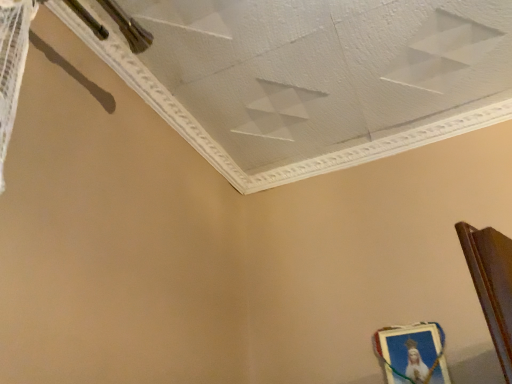
Question: Is point (326, 147) closer or farther from the camera than point (380, 354)?

Choices:
 (A) farther
 (B) closer

Answer: (A)

Question: In terms of size, does white textured ceiling at upper center appear bigger or smaller than metallic gold picture frame at lower right?

Choices:
 (A) small
 (B) big

Answer: (B)

Question: Relative to metallic gold picture frame at lower right, is white textured ceiling at upper center in front or behind?

Choices:
 (A) behind
 (B) front

Answer: (B)

Question: In terms of height, does metallic gold picture frame at lower right look taller or shorter compared to white textured ceiling at upper center?

Choices:
 (A) tall
 (B) short

Answer: (A)

Question: Is metallic gold picture frame at lower right spatially inside white textured ceiling at upper center, or outside of it?

Choices:
 (A) outside
 (B) inside

Answer: (A)

Question: Considering their positions, is metallic gold picture frame at lower right located in front of or behind white textured ceiling at upper center?

Choices:
 (A) behind
 (B) front

Answer: (A)

Question: Is point (402, 354) closer or farther from the camera than point (240, 33)?

Choices:
 (A) farther
 (B) closer

Answer: (A)